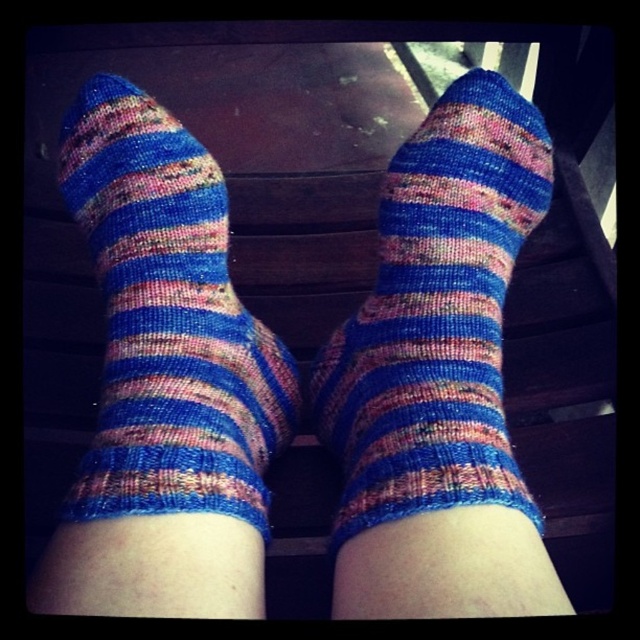
Can you confirm if blue striped sock at center is taller than multicolored knitted sock at center?

Correct, blue striped sock at center is much taller as multicolored knitted sock at center.

Measure the distance between point [337,538] and camera.

Point [337,538] and camera are 21.92 inches apart from each other.

The width and height of the screenshot is (640, 640). What are the coordinates of `blue striped sock at center` in the screenshot? It's located at (436, 316).

Find the location of a particular element. The height and width of the screenshot is (640, 640). blue striped sock at center is located at coordinates (436, 316).